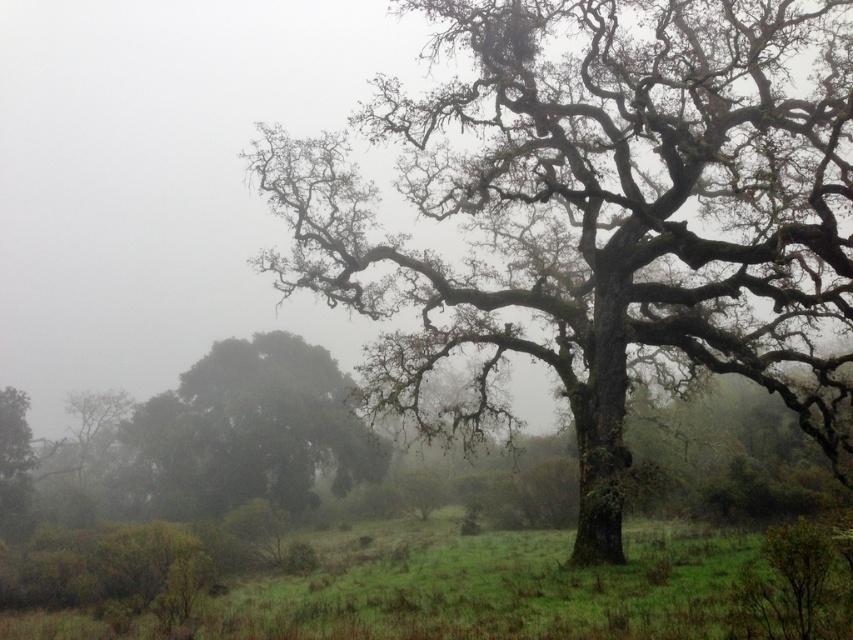
Consider the image. You are standing in the misty landscape looking at the large tree. There are two points marked in the image. Which point is closer to you, point [659,168] or point [224,419]?

Point [224,419] is closer to you because the description states that point [659,168] is further to the camera than point [224,419].